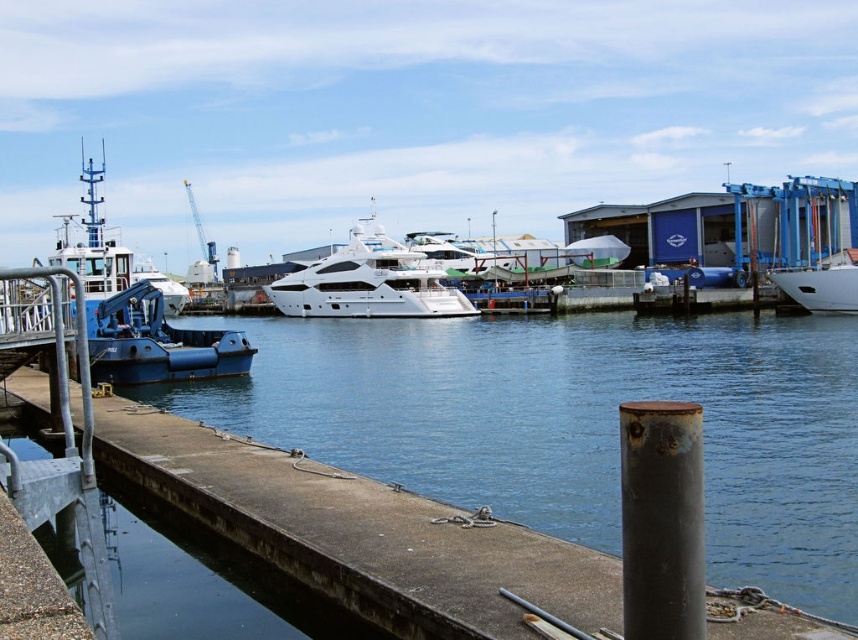
Who is shorter, white glossy yacht at center or white glossy boat at right?

white glossy boat at right is shorter.

Who is positioned more to the right, white glossy yacht at center or white glossy boat at right?

Positioned to the right is white glossy boat at right.

Where is `white glossy yacht at center`? The width and height of the screenshot is (858, 640). white glossy yacht at center is located at coordinates (369, 282).

Can you confirm if smooth concrete dock at center is positioned above blue matte tugboat at left?

No, smooth concrete dock at center is not above blue matte tugboat at left.

What do you see at coordinates (573, 422) in the screenshot?
I see `smooth concrete dock at center` at bounding box center [573, 422].

Where is `smooth concrete dock at center`? smooth concrete dock at center is located at coordinates (573, 422).

Locate an element on the screen. The width and height of the screenshot is (858, 640). smooth concrete dock at center is located at coordinates (573, 422).

Is point (322, 346) farther from camera compared to point (801, 304)?

No, it is in front of (801, 304).

Image resolution: width=858 pixels, height=640 pixels. I want to click on smooth concrete dock at center, so click(x=573, y=422).